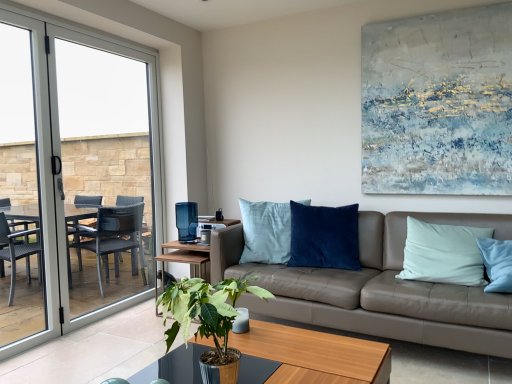
Question: From the image's perspective, would you say green leafy plant at center is positioned over textured canvas painting at upper right?

Choices:
 (A) yes
 (B) no

Answer: (B)

Question: Is green leafy plant at center shorter than textured canvas painting at upper right?

Choices:
 (A) no
 (B) yes

Answer: (B)

Question: Is textured canvas painting at upper right surrounded by green leafy plant at center?

Choices:
 (A) yes
 (B) no

Answer: (B)

Question: Is green leafy plant at center facing away from textured canvas painting at upper right?

Choices:
 (A) no
 (B) yes

Answer: (A)

Question: Does green leafy plant at center have a lesser width compared to textured canvas painting at upper right?

Choices:
 (A) yes
 (B) no

Answer: (B)

Question: Is green leafy plant at center in front of or behind wooden coffee table at center in the image?

Choices:
 (A) behind
 (B) front

Answer: (B)

Question: Is green leafy plant at center bigger or smaller than wooden coffee table at center?

Choices:
 (A) small
 (B) big

Answer: (A)

Question: From the image's perspective, is green leafy plant at center above or below wooden coffee table at center?

Choices:
 (A) above
 (B) below

Answer: (A)

Question: From their relative heights in the image, would you say green leafy plant at center is taller or shorter than wooden coffee table at center?

Choices:
 (A) short
 (B) tall

Answer: (B)

Question: Considering the positions of clear glass door at left and leather couch at center in the image, is clear glass door at left wider or thinner than leather couch at center?

Choices:
 (A) thin
 (B) wide

Answer: (A)

Question: In terms of size, does clear glass door at left appear bigger or smaller than leather couch at center?

Choices:
 (A) big
 (B) small

Answer: (B)

Question: Considering the positions of point (145, 114) and point (240, 248), is point (145, 114) closer or farther from the camera than point (240, 248)?

Choices:
 (A) closer
 (B) farther

Answer: (B)

Question: From a real-world perspective, is clear glass door at left above or below leather couch at center?

Choices:
 (A) above
 (B) below

Answer: (A)

Question: Is green leafy plant at center spatially inside clear glass door at left, or outside of it?

Choices:
 (A) outside
 (B) inside

Answer: (A)

Question: Is green leafy plant at center taller or shorter than clear glass door at left?

Choices:
 (A) short
 (B) tall

Answer: (A)